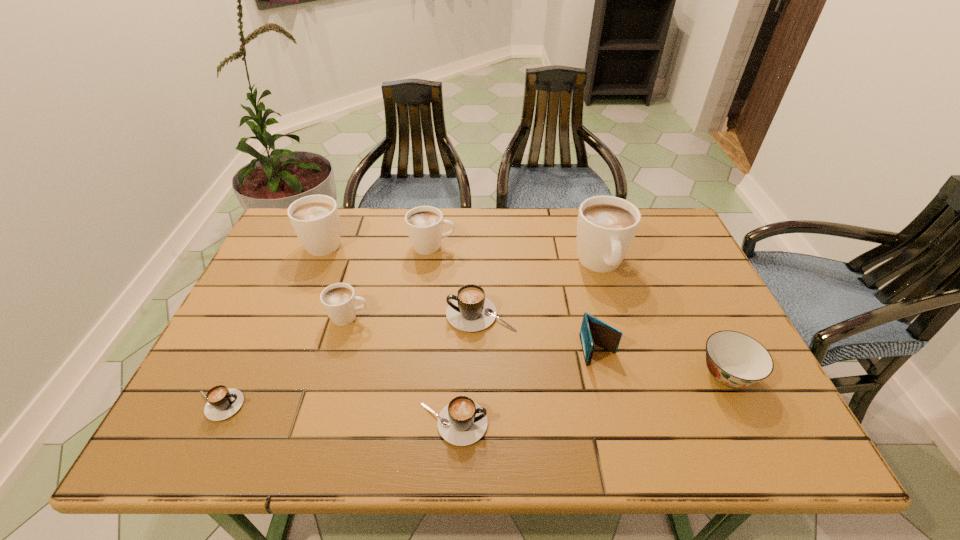
This screenshot has width=960, height=540. In order to click on blank area in the image that satisfies the following two spatial constraints: 1. on the exterior surface of the wallet; 2. with the handle on the side of the leftmost black cappuccino in this screenshot , I will do `click(612, 406)`.

The width and height of the screenshot is (960, 540). What are the coordinates of `vacant space that satisfies the following two spatial constraints: 1. with the handle on the side of the rightmost white cappuccino; 2. with the handle on the side of the third cappuccino from left to right` in the screenshot? It's located at (616, 317).

This screenshot has width=960, height=540. I want to click on vacant area that satisfies the following two spatial constraints: 1. on the exterior surface of the wallet; 2. with the handle on the side of the shortest object, so click(612, 406).